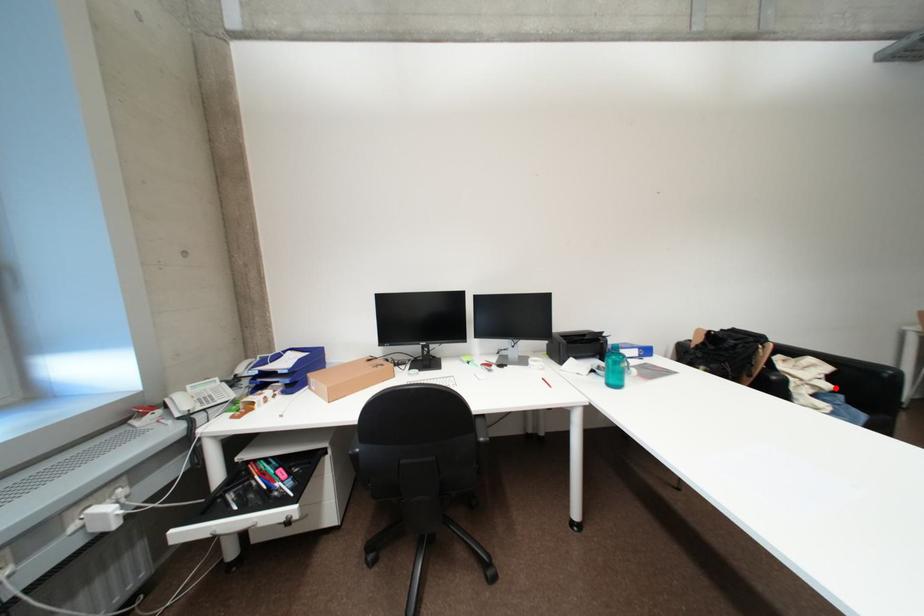
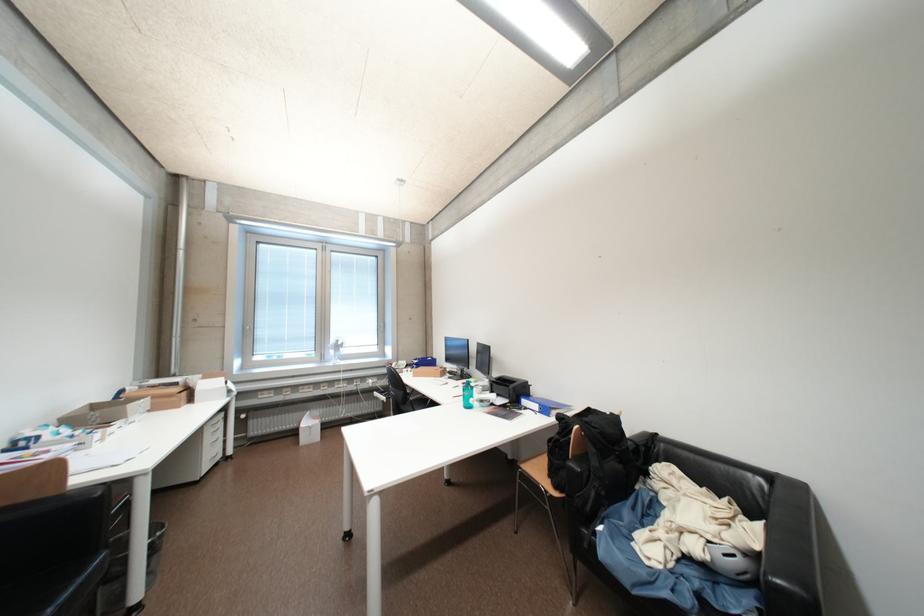
Question: A red point is marked in image1. In image2, is the corresponding 3D point closer to the camera or farther? Reply with the corresponding letter.

Choices:
 (A) The corresponding 3D point is closer.
 (B) The corresponding 3D point is farther.

Answer: (B)